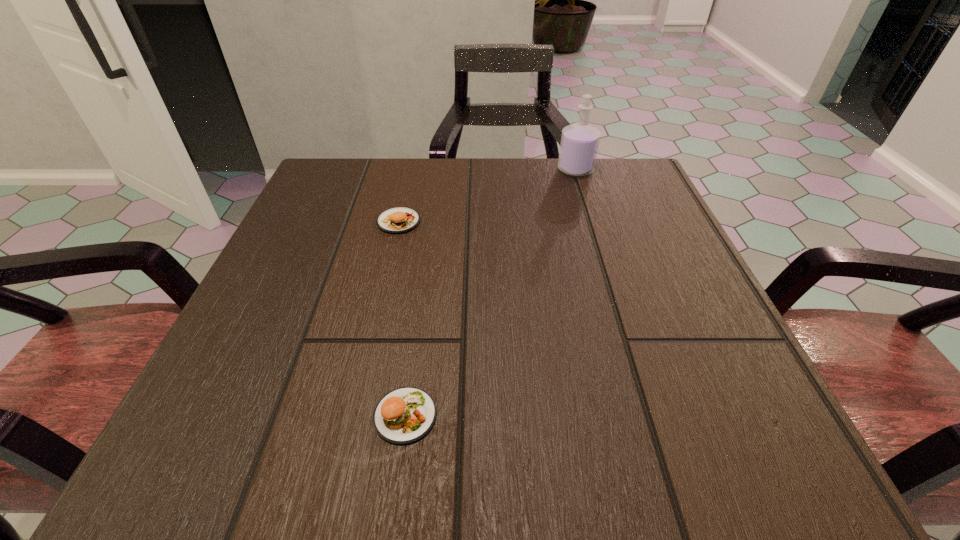
Find the location of a particular element. The image size is (960, 540). free space at the far right corner of the desktop is located at coordinates (624, 185).

This screenshot has width=960, height=540. In order to click on vacant area that lies between the tallest object and the second nearest object in this screenshot , I will do `click(487, 195)`.

The width and height of the screenshot is (960, 540). I want to click on free spot between the farthest object and the nearer patty, so click(x=491, y=293).

Locate an element on the screen. The width and height of the screenshot is (960, 540). vacant area between the tallest object and the second tallest object is located at coordinates (487, 195).

The height and width of the screenshot is (540, 960). I want to click on free spot between the farther patty and the farthest object, so click(487, 195).

Locate an element on the screen. This screenshot has width=960, height=540. vacant space in between the tallest object and the shortest object is located at coordinates (491, 293).

You are a GUI agent. You are given a task and a screenshot of the screen. Output one action in this format:
    pyautogui.click(x=<x>, y=<y>)
    Task: Click on the free space between the second farthest object and the shortest object
    The image size is (960, 540).
    Given the screenshot: What is the action you would take?
    pyautogui.click(x=402, y=319)

Find the location of a particular element. The height and width of the screenshot is (540, 960). free spot between the nearer patty and the farther patty is located at coordinates (402, 319).

Identify the location of vacant area that lies between the rightmost object and the second shortest object. This screenshot has width=960, height=540. click(x=487, y=195).

In order to click on free spot between the tallest object and the shorter patty in this screenshot , I will do `click(491, 293)`.